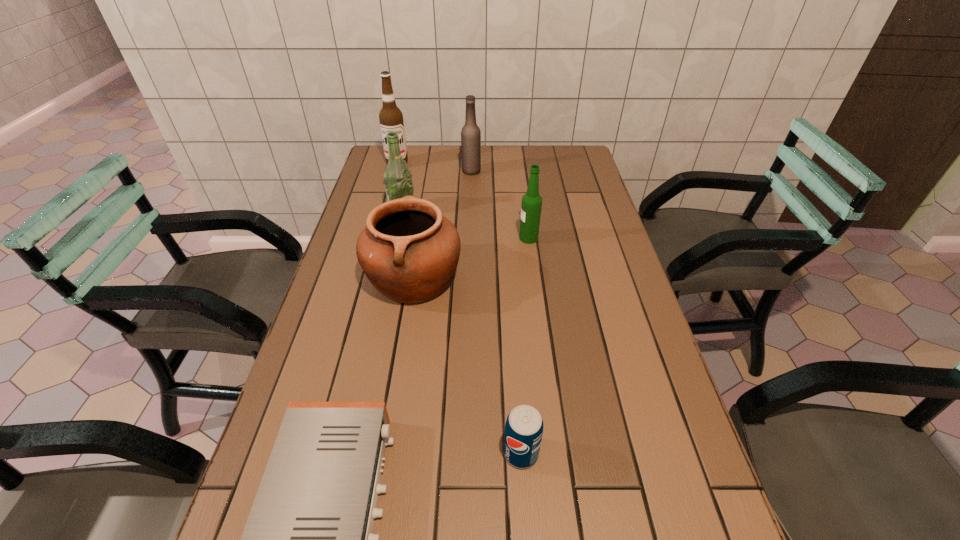
What are the coordinates of `free space located on the label of the tallest object` in the screenshot? It's located at (380, 227).

The height and width of the screenshot is (540, 960). I want to click on vacant space positioned on the label of the farthest beer bottle, so pos(562,171).

Locate an element on the screen. The height and width of the screenshot is (540, 960). vacant space located on the surface of the leftmost beer bottle is located at coordinates coord(522,210).

Find the location of a particular element. This screenshot has height=540, width=960. vacant space situated on the label of the nearest beer bottle is located at coordinates [423, 238].

At what (x,y) coordinates should I click in order to perform the action: click on blank space located 0.370m on the label of the nearest beer bottle. Please return your answer as a coordinate pair (x, y). Looking at the image, I should click on (397, 238).

Locate an element on the screen. This screenshot has width=960, height=540. free space located on the label of the nearest beer bottle is located at coordinates tap(496, 238).

At what (x,y) coordinates should I click in order to perform the action: click on vacant region located on the left of the pottery. Please return your answer as a coordinate pair (x, y). The width and height of the screenshot is (960, 540). Looking at the image, I should click on (328, 278).

Where is `free space located on the right of the sixth tallest object`? free space located on the right of the sixth tallest object is located at coordinates (653, 453).

Find the location of a particular element. alcohol that is at the far edge is located at coordinates (391, 118).

You are a GUI agent. You are given a task and a screenshot of the screen. Output one action in this format:
    pyautogui.click(x=<x>, y=<y>)
    Task: Click on the beer bottle at the far edge
    Image resolution: width=960 pixels, height=540 pixels.
    Given the screenshot: What is the action you would take?
    pyautogui.click(x=470, y=134)